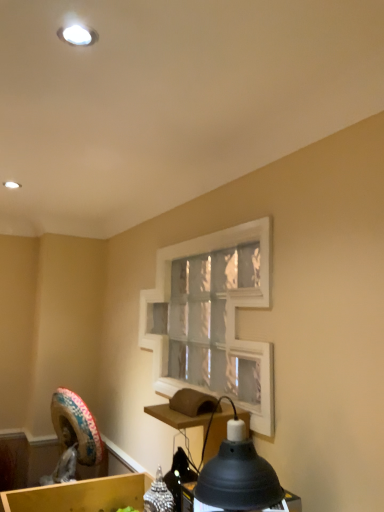
Question: Is wooden cardboard box at lower left thinner than white matte window frame at center?

Choices:
 (A) yes
 (B) no

Answer: (B)

Question: Is the position of wooden cardboard box at lower left more distant than that of white matte window frame at center?

Choices:
 (A) no
 (B) yes

Answer: (B)

Question: Considering the relative sizes of wooden cardboard box at lower left and white matte window frame at center in the image provided, is wooden cardboard box at lower left smaller than white matte window frame at center?

Choices:
 (A) yes
 (B) no

Answer: (A)

Question: From the image's perspective, does wooden cardboard box at lower left appear higher than white matte window frame at center?

Choices:
 (A) yes
 (B) no

Answer: (B)

Question: From a real-world perspective, is wooden cardboard box at lower left under white matte window frame at center?

Choices:
 (A) yes
 (B) no

Answer: (A)

Question: Are wooden cardboard box at lower left and white matte window frame at center located far from each other?

Choices:
 (A) yes
 (B) no

Answer: (B)

Question: From the image's perspective, does white matte window frame at center appear lower than matte black lampshade at lower center?

Choices:
 (A) yes
 (B) no

Answer: (B)

Question: From a real-world perspective, is white matte window frame at center over matte black lampshade at lower center?

Choices:
 (A) no
 (B) yes

Answer: (B)

Question: Could matte black lampshade at lower center be considered to be inside white matte window frame at center?

Choices:
 (A) yes
 (B) no

Answer: (B)

Question: Is white matte window frame at center looking in the opposite direction of matte black lampshade at lower center?

Choices:
 (A) yes
 (B) no

Answer: (B)

Question: From a real-world perspective, is white matte window frame at center beneath matte black lampshade at lower center?

Choices:
 (A) yes
 (B) no

Answer: (B)

Question: Is white matte window frame at center far away from matte black lampshade at lower center?

Choices:
 (A) yes
 (B) no

Answer: (B)

Question: Does white matte window frame at center have a greater height compared to wooden cardboard box at lower left?

Choices:
 (A) no
 (B) yes

Answer: (B)